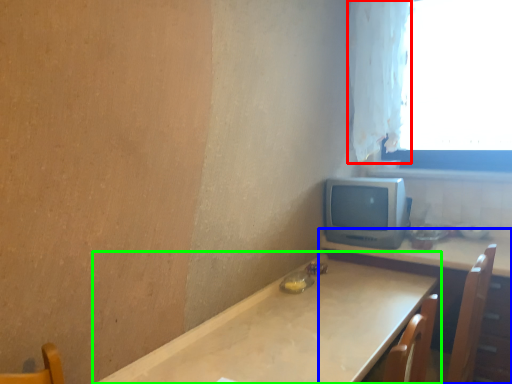
Question: Estimate the real-world distances between objects in this image. Which object is farther from curtain (highlighted by a red box), table (highlighted by a blue box) or table (highlighted by a green box)?

Choices:
 (A) table
 (B) table

Answer: (B)